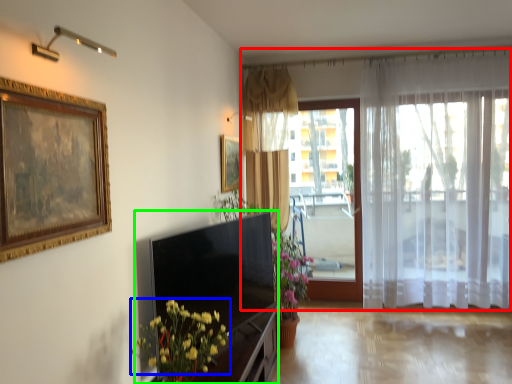
Question: Which is nearer to the curtain (highlighted by a red box)? flower (highlighted by a blue box) or entertainment center (highlighted by a green box).

Choices:
 (A) flower
 (B) entertainment center

Answer: (B)